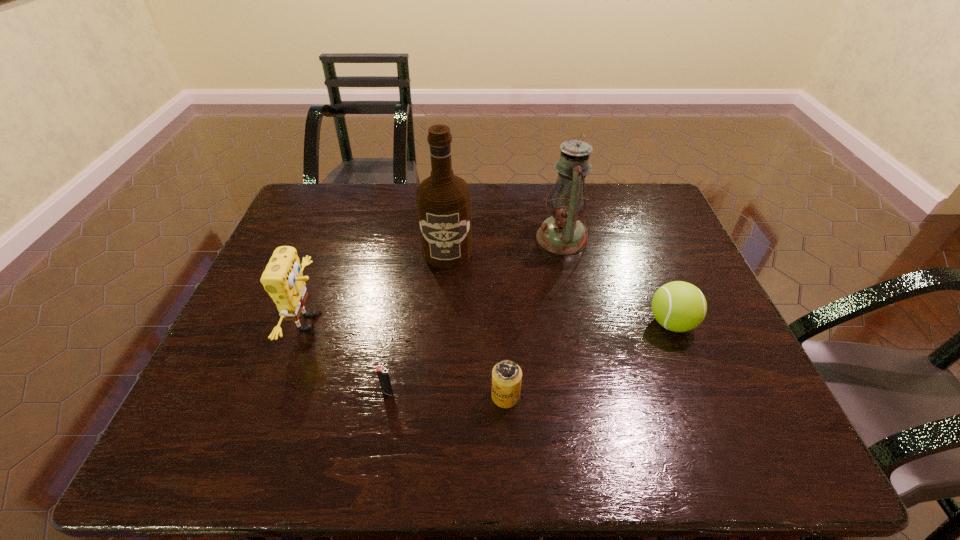
The image size is (960, 540). I want to click on alcohol, so click(x=443, y=200).

Find the location of a particular element. the second object from right to left is located at coordinates (562, 233).

Identify the location of the third tallest object. (283, 279).

The width and height of the screenshot is (960, 540). I want to click on sponge, so click(x=283, y=279).

The height and width of the screenshot is (540, 960). In order to click on the rightmost object in this screenshot , I will do `click(678, 306)`.

This screenshot has height=540, width=960. Find the location of `the fourth object from left to right`. the fourth object from left to right is located at coordinates (506, 375).

What are the coordinates of `igniter` in the screenshot? It's located at (383, 375).

You are a GUI agent. You are given a task and a screenshot of the screen. Output one action in this format:
    pyautogui.click(x=<x>, y=<y>)
    Task: Click on the fifth object from right to left
    
    Given the screenshot: What is the action you would take?
    pyautogui.click(x=383, y=375)

Where is `vacant space situated on the label of the third object from left to right`? The height and width of the screenshot is (540, 960). vacant space situated on the label of the third object from left to right is located at coordinates (441, 330).

This screenshot has height=540, width=960. In order to click on free point located 0.280m on the front of the second object from right to left in this screenshot , I will do `click(583, 338)`.